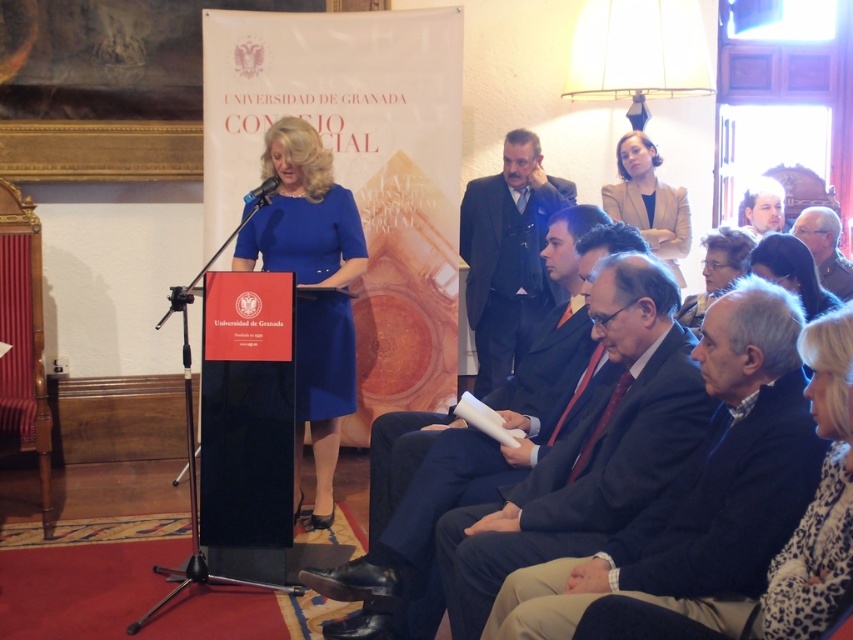
Is blue fabric dress at center wider than gray fabric jacket at upper right?

Yes.

Looking at this image, can you confirm if blue fabric dress at center is positioned below gray fabric jacket at upper right?

Yes, blue fabric dress at center is below gray fabric jacket at upper right.

Is point (268, 243) positioned before point (838, 234)?

Yes, point (268, 243) is in front of point (838, 234).

Find the location of `blue fabric dress at center`. blue fabric dress at center is located at coordinates (303, 212).

Between dark brown fur coat at lower right and light brown hair at upper right, which one is positioned higher?

light brown hair at upper right is above.

Between point (798, 259) and point (779, 211), which one is positioned in front?

Point (798, 259) is in front.

The image size is (853, 640). In order to click on dark brown fur coat at lower right in this screenshot , I will do `click(791, 272)`.

Who is shorter, dark suit at center or gray fabric jacket at upper right?

gray fabric jacket at upper right is shorter.

Does dark suit at center have a larger size compared to gray fabric jacket at upper right?

Correct, dark suit at center is larger in size than gray fabric jacket at upper right.

This screenshot has height=640, width=853. Identify the location of dark suit at center. (477, 458).

Identify the location of dark suit at center. point(477,458).